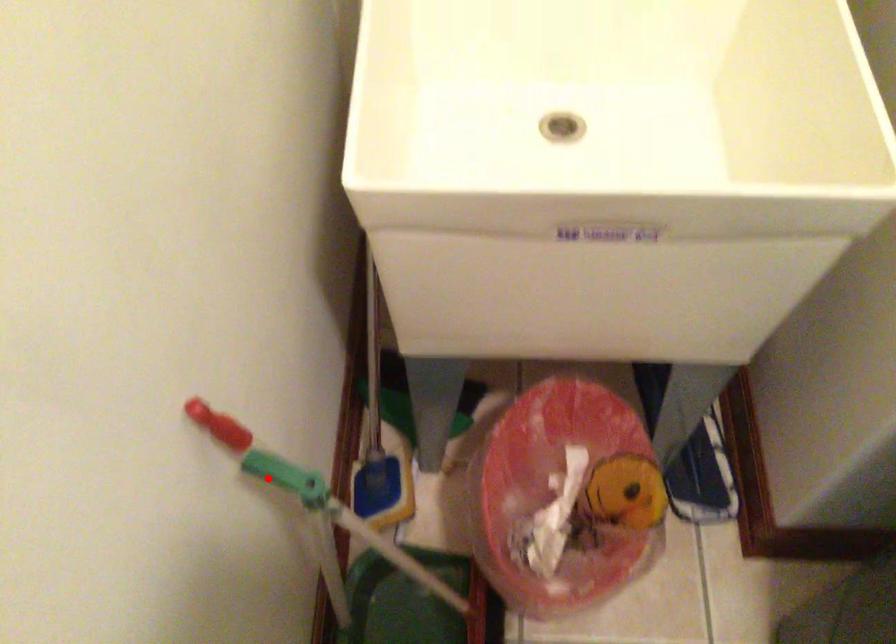
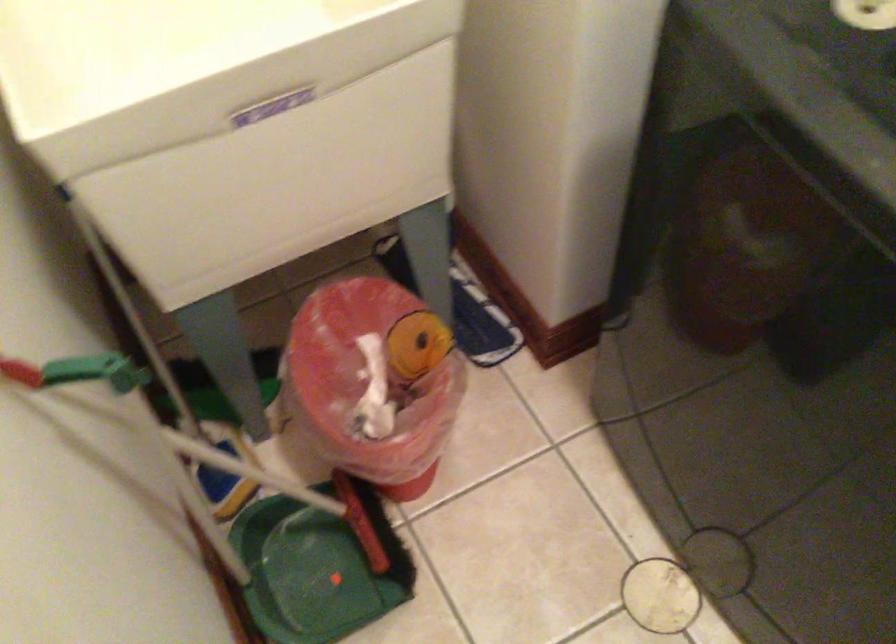
Question: I am providing you with two images of the same scene from different viewpoints. Image1 has a red point marked. In image2, the corresponding 3D location appears at what relative position? Reply with the corresponding letter.

Choices:
 (A) Closer
 (B) Farther

Answer: (B)